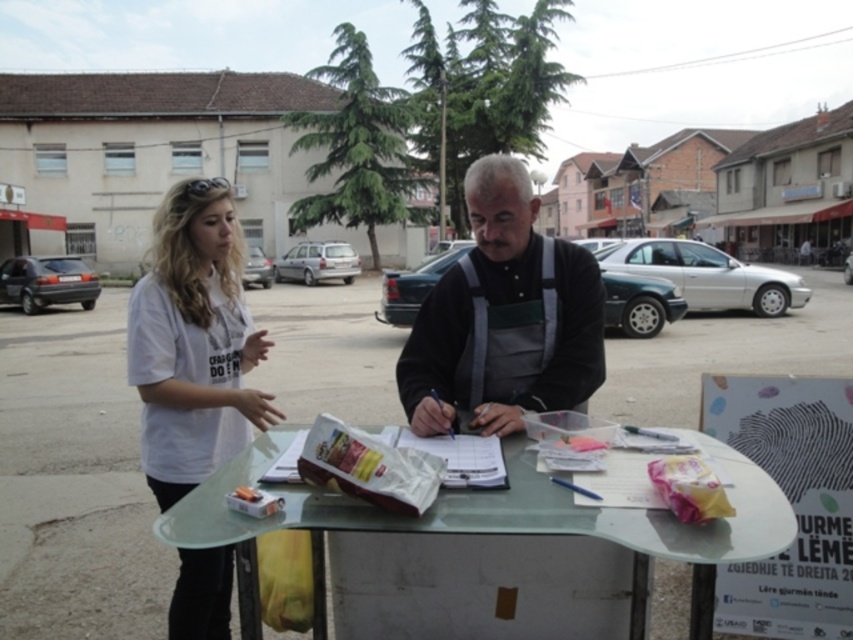
You are standing in the outdoor area and see the clear glass table at center and the white cotton shirt at left. Which object is positioned to the right of the other?

The clear glass table at center is to the right of the white cotton shirt at left.

You are standing at the center of the image and see a white t shirt at point (x=503, y=317). Is the white t shirt closer to the top or bottom of the image?

The white t shirt at point (x=503, y=317) is closer to the bottom of the image because its y coordinate is 0.592, which is below the center point of 0.5.